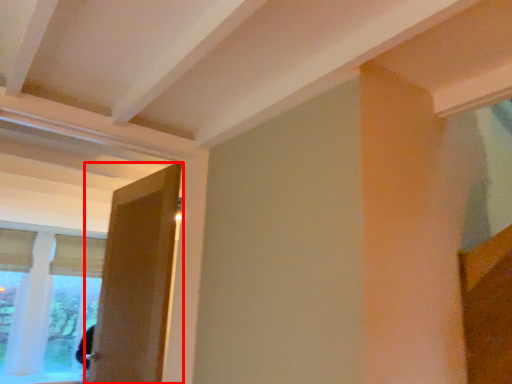
Question: From the image, what is the correct spatial relationship of door (annotated by the red box) in relation to window?

Choices:
 (A) right
 (B) left

Answer: (A)